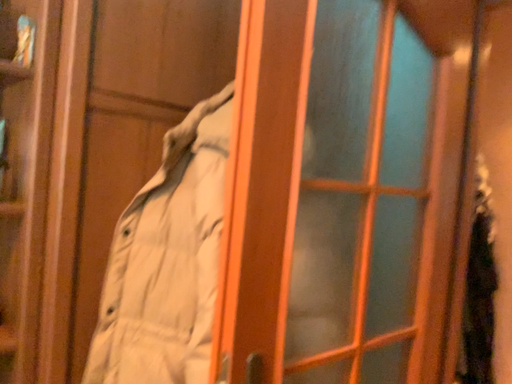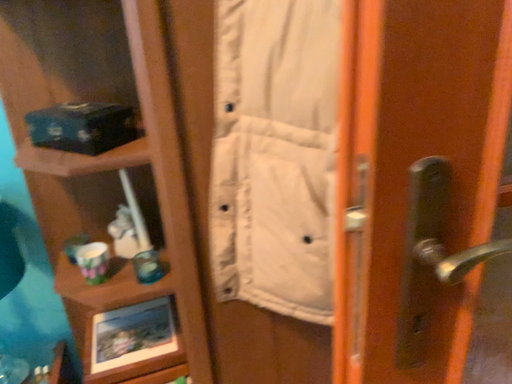
Question: How did the camera likely rotate when shooting the video?

Choices:
 (A) rotated left
 (B) rotated right

Answer: (A)